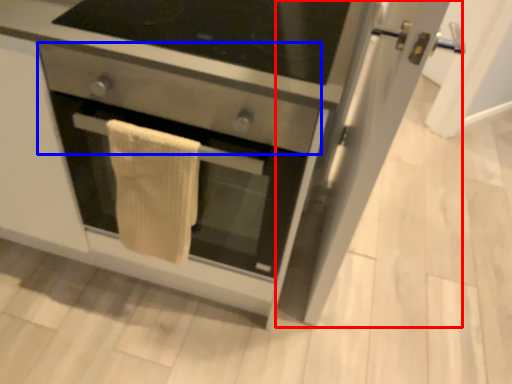
Question: Which object appears farthest to the camera in this image, glass door (highlighted by a red box) or drawer (highlighted by a blue box)?

Choices:
 (A) glass door
 (B) drawer

Answer: (B)